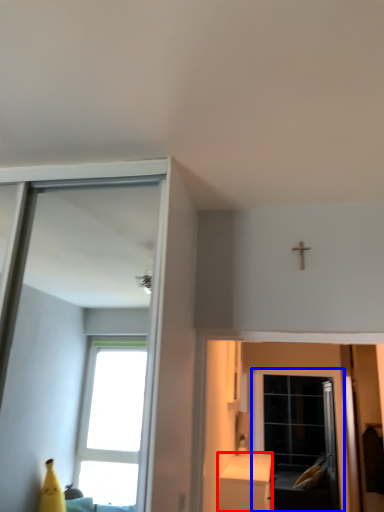
Question: Which point is further to the camera, furniture (highlighted by a red box) or screen door (highlighted by a blue box)?

Choices:
 (A) furniture
 (B) screen door

Answer: (B)